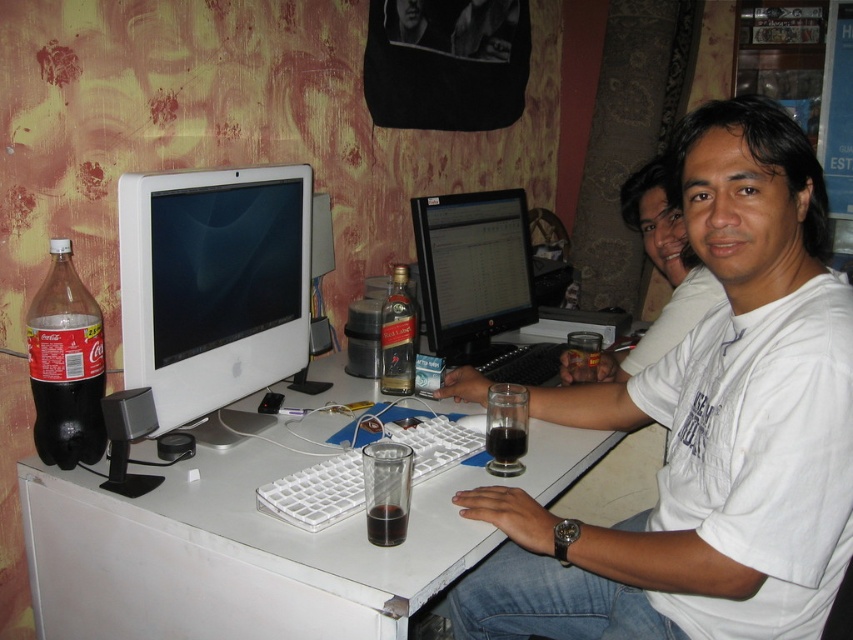
Question: Is matte black monitor at center thinner than translucent glass bottle at center?

Choices:
 (A) no
 (B) yes

Answer: (A)

Question: Which of the following is the farthest from the observer?

Choices:
 (A) translucent glass cup at desk center
 (B) transparent glass at desk center
 (C) translucent plastic coca-cola bottle at left

Answer: (A)

Question: Which of the following is the farthest from the observer?

Choices:
 (A) transparent glass at desk center
 (B) white glossy computer monitor at center
 (C) white plastic keyboard at center
 (D) translucent plastic coca-cola bottle at left

Answer: (D)

Question: Considering the real-world distances, which object is closest to the transparent glass at desk center?

Choices:
 (A) white plastic computer desk at center
 (B) white glossy computer monitor at center
 (C) translucent glass cup at desk center

Answer: (C)

Question: Does translucent plastic coca-cola bottle at left have a greater width compared to translucent glass bottle at center?

Choices:
 (A) no
 (B) yes

Answer: (B)

Question: Is white plastic computer desk at center below white plastic keyboard at center?

Choices:
 (A) yes
 (B) no

Answer: (A)